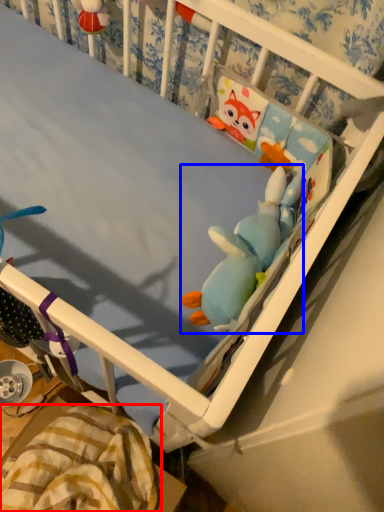
Question: Which object appears farthest to the camera in this image, blanket (highlighted by a red box) or toy (highlighted by a blue box)?

Choices:
 (A) blanket
 (B) toy

Answer: (A)